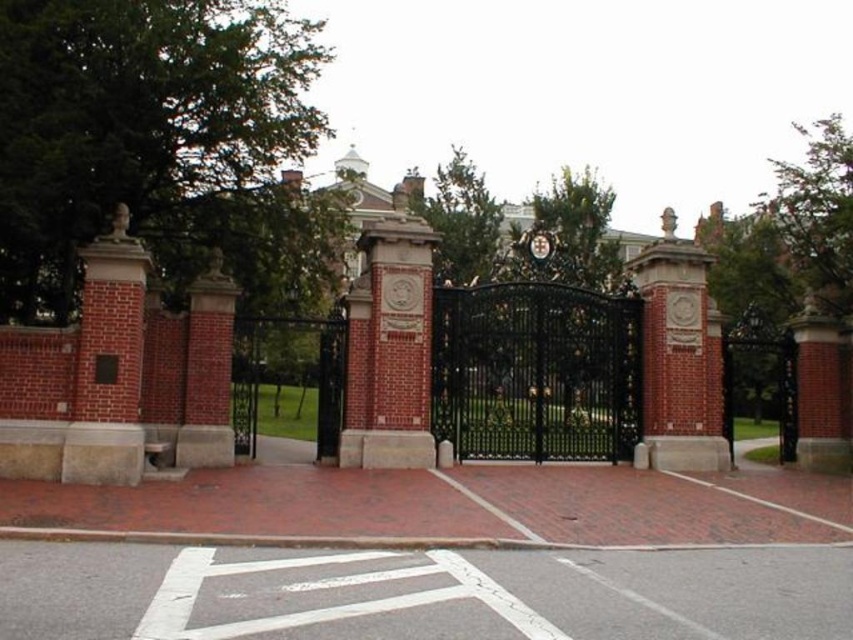
You are a visitor approaching the entrance and see the black wrought iron gate at center and the metallic clock at center. Which object is located to the left when facing the entrance?

The black wrought iron gate at center is positioned on the left side of the metallic clock at center, so it is located to the left when facing the entrance.

You are a visitor approaching the entrance and see the black wrought iron gate at center and the metallic clock at center. Which object is closer to the ground?

The black wrought iron gate at center is closer to the ground because it is positioned under the metallic clock at center.

You are standing at the entrance of the estate and want to locate the black wrought iron gate at center. According to the coordinates provided, where should you look?

The black wrought iron gate at center is located at point (x=537, y=372).